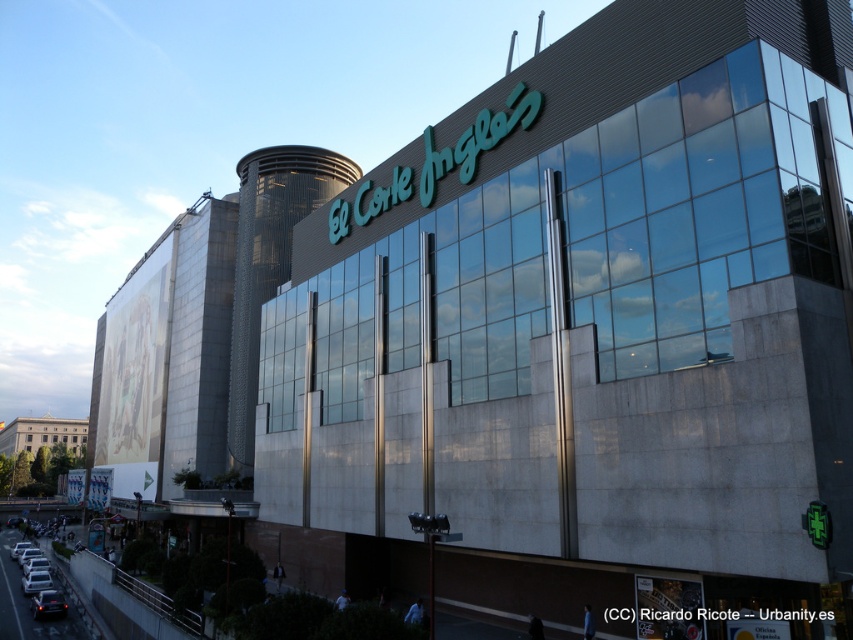
Question: Does metallic silver car at lower left come behind silver metallic car at lower left?

Choices:
 (A) no
 (B) yes

Answer: (A)

Question: Is metallic silver car at lower left closer to camera compared to silver metallic car at lower left?

Choices:
 (A) yes
 (B) no

Answer: (A)

Question: Among these objects, which one is farthest from the camera?

Choices:
 (A) silver metallic car at lower left
 (B) metallic silver car at lower left

Answer: (A)

Question: Does metallic silver car at lower left appear on the right side of silver metallic car at lower left?

Choices:
 (A) yes
 (B) no

Answer: (A)

Question: Which object is farther from the camera taking this photo?

Choices:
 (A) silver metallic car at lower left
 (B) metallic silver car at lower left

Answer: (A)

Question: Which object is closer to the camera taking this photo?

Choices:
 (A) metallic silver car at lower left
 (B) silver metallic car at lower left

Answer: (A)